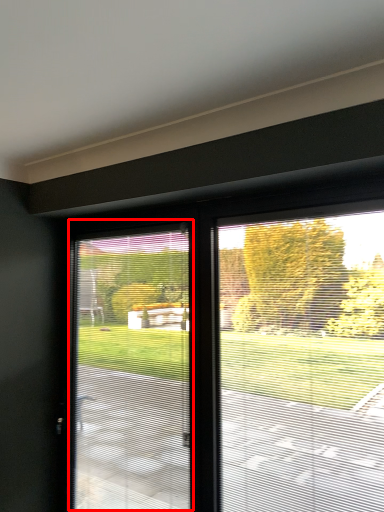
Question: From the image's perspective, what is the correct spatial positioning of window screen (annotated by the red box) in reference to window screen?

Choices:
 (A) below
 (B) above

Answer: (A)